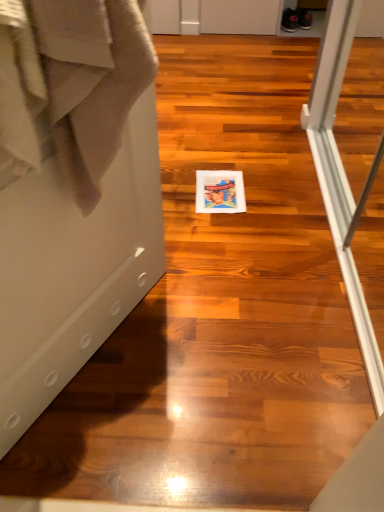
Identify the location of blank space above matte paper postcard at center (from a real-world perspective). (220, 187).